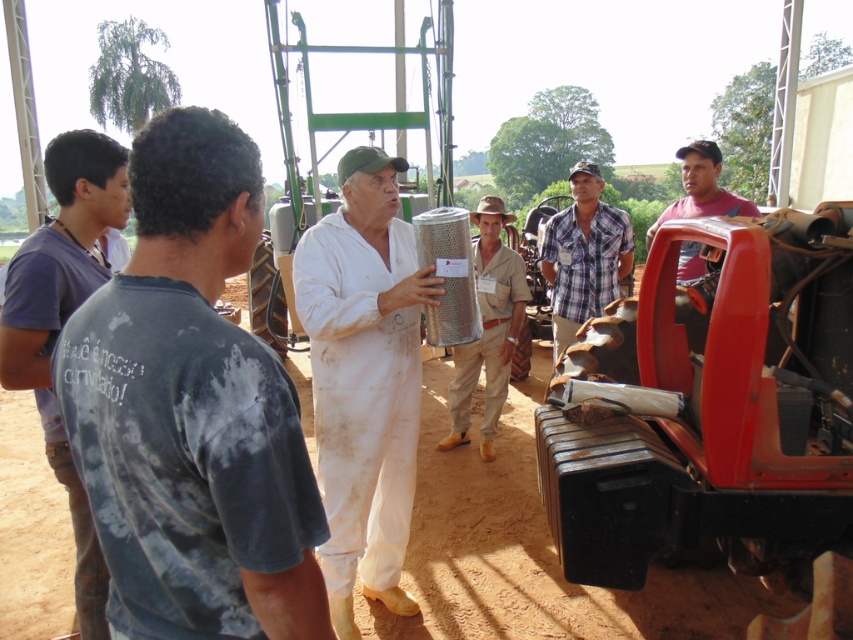
Is white matte jumpsuit at center below dark blue shirt at left?

Indeed, white matte jumpsuit at center is positioned under dark blue shirt at left.

What are the coordinates of `white matte jumpsuit at center` in the screenshot? It's located at (364, 380).

From the picture: Which is more to the right, dark blue shirt at left or metallic mesh filter at center?

From the viewer's perspective, metallic mesh filter at center appears more on the right side.

Is point (125, 193) less distant than point (506, 276)?

Yes, point (125, 193) is closer to viewer.

Locate an element on the screen. The height and width of the screenshot is (640, 853). dark blue shirt at left is located at coordinates (65, 320).

Is metallic mesh filter at center shorter than plaid fabric shirt at center?

In fact, metallic mesh filter at center may be taller than plaid fabric shirt at center.

Is metallic mesh filter at center wider than plaid fabric shirt at center?

Correct, the width of metallic mesh filter at center exceeds that of plaid fabric shirt at center.

This screenshot has width=853, height=640. I want to click on metallic mesh filter at center, so click(488, 328).